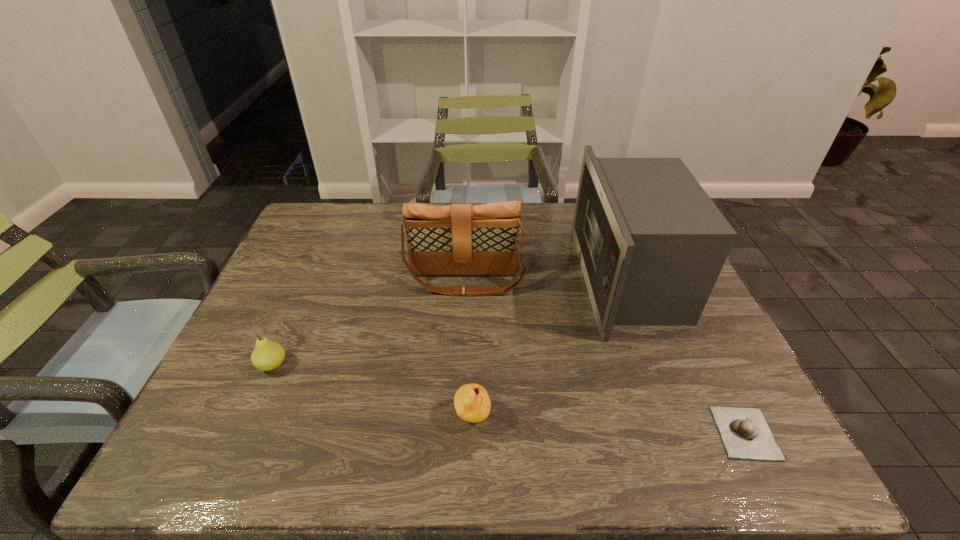
In order to click on free space that satisfies the following two spatial constraints: 1. on the front-facing side of the microwave oven; 2. on the left side of the garlic in this screenshot , I will do `click(686, 433)`.

You are a GUI agent. You are given a task and a screenshot of the screen. Output one action in this format:
    pyautogui.click(x=<x>, y=<y>)
    Task: Click on the free space that satisfies the following two spatial constraints: 1. on the front-facing side of the tallest object; 2. on the front-facing side of the fourth shortest object
    The width and height of the screenshot is (960, 540).
    Given the screenshot: What is the action you would take?
    pyautogui.click(x=628, y=280)

I want to click on free space that satisfies the following two spatial constraints: 1. on the front-facing side of the microwave oven; 2. on the back side of the shortest object, so pyautogui.click(x=686, y=433).

Find the location of `vacant area in the image that satisfies the following two spatial constraints: 1. on the front-facing side of the microwave oven; 2. on the front side of the right pear`. vacant area in the image that satisfies the following two spatial constraints: 1. on the front-facing side of the microwave oven; 2. on the front side of the right pear is located at coordinates (680, 417).